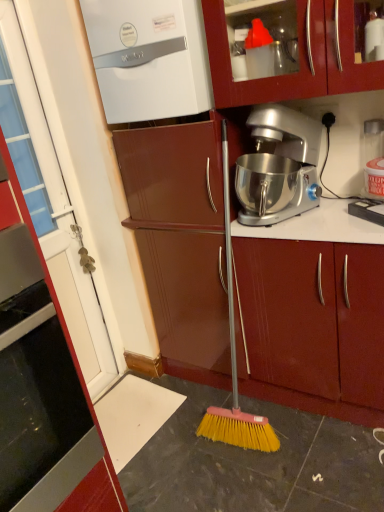
What are the coordinates of `vacant region above matte wood cabinet at center, which ranks as the 2th cabinetry in left-to-right order (from a real-world perspective)` in the screenshot? It's located at (327, 217).